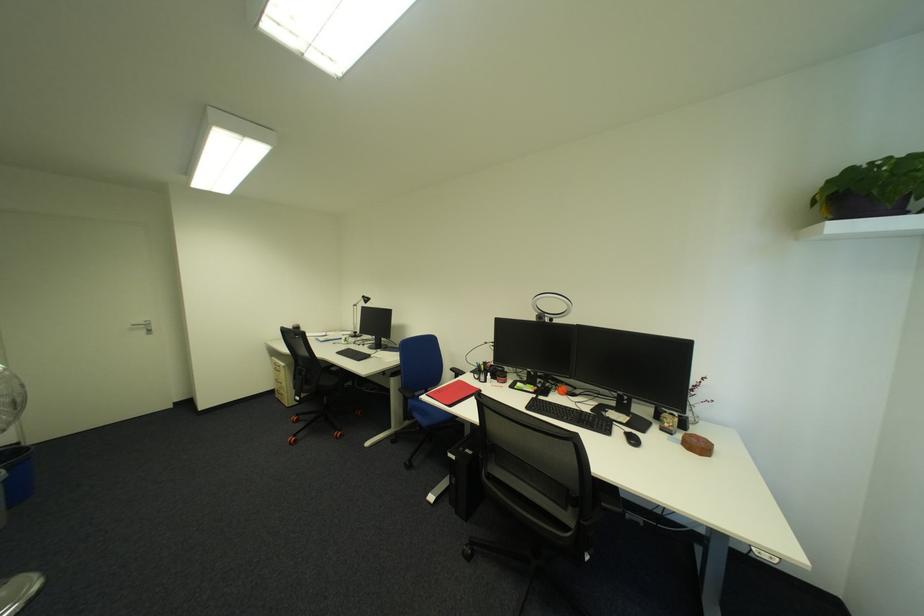
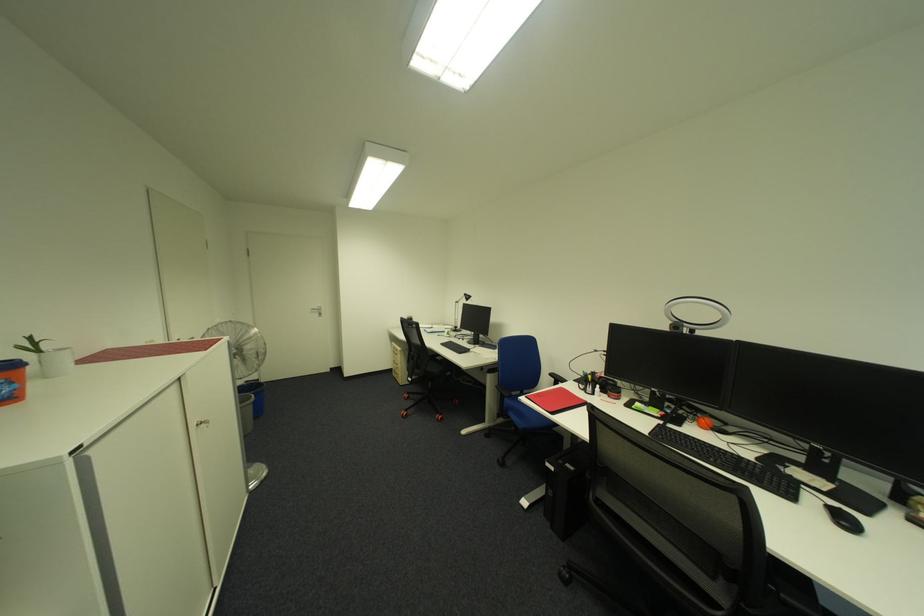
Question: The first image is from the beginning of the video and the second image is from the end. How did the camera likely rotate when shooting the video?

Choices:
 (A) Left
 (B) Right
 (C) Up
 (D) Down

Answer: (A)